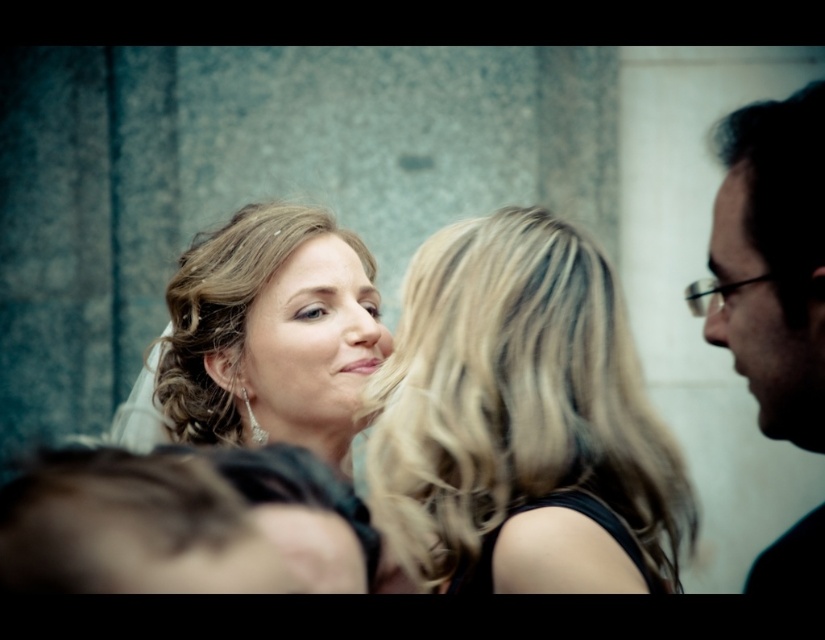
Does black matte glasses at right have a larger size compared to black glossy glasses at right?

Indeed, black matte glasses at right has a larger size compared to black glossy glasses at right.

Where is `black matte glasses at right`? Image resolution: width=825 pixels, height=640 pixels. black matte glasses at right is located at coordinates (771, 260).

Locate an element on the screen. The image size is (825, 640). black matte glasses at right is located at coordinates (771, 260).

Which of these two, blonde shiny hair at center or black glossy glasses at right, stands shorter?

With less height is black glossy glasses at right.

Is blonde shiny hair at center to the right of black glossy glasses at right from the viewer's perspective?

Incorrect, blonde shiny hair at center is not on the right side of black glossy glasses at right.

Is point (231, 348) positioned in front of point (798, 440)?

No, (231, 348) is behind (798, 440).

Locate an element on the screen. blonde shiny hair at center is located at coordinates (225, 312).

Who is shorter, blonde shiny hair at center or matte gold hair at center?

matte gold hair at center is shorter.

Can you confirm if blonde shiny hair at center is positioned below matte gold hair at center?

No.

The height and width of the screenshot is (640, 825). Describe the element at coordinates (225, 312) in the screenshot. I see `blonde shiny hair at center` at that location.

Find the location of a particular element. The image size is (825, 640). blonde shiny hair at center is located at coordinates (225, 312).